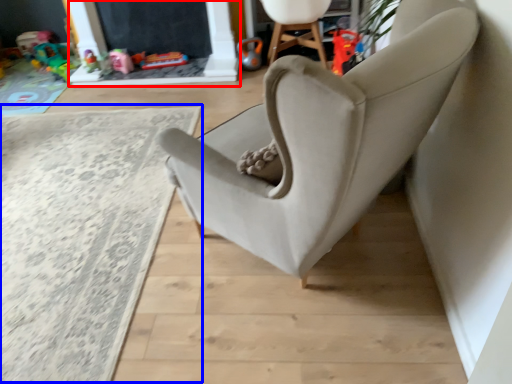
Question: Which object is closer to the camera taking this photo, fireplace (highlighted by a red box) or plain (highlighted by a blue box)?

Choices:
 (A) fireplace
 (B) plain

Answer: (B)